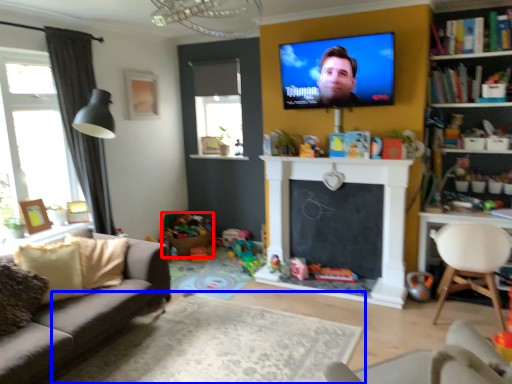
Question: Among these objects, which one is nearest to the camera, toy (highlighted by a red box) or plain (highlighted by a blue box)?

Choices:
 (A) toy
 (B) plain

Answer: (B)